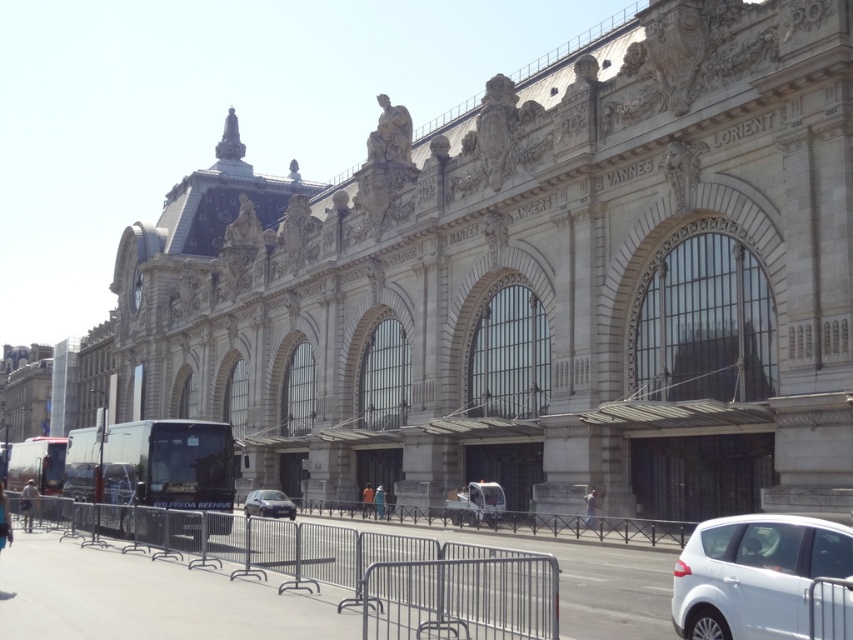
You are a pedestrian standing in front of the grand building and see both the matte black bus at lower left and the metallic silver bus at lower left. Which bus takes up more space in the image?

The metallic silver bus at lower left takes up more space in the image since the matte black bus at lower left occupies less space than it.

You are a fashion designer observing two jackets in an image of a historical train station. The scene includes a light brown leather jacket at lower left and an orange fabric jacket at center. Which jacket is covering the other one?

The light brown leather jacket at lower left is positioned over the orange fabric jacket at center, meaning it is covering the other jacket.

You are standing in front of the grand ornate building with the names Lorient, Vannes, and Nantes inscribed on it. You notice a point labeled at coordinates (36, 465). Based on the building facade details, what object is located at that point?

The point at coordinates (36, 465) indicates a metallic silver bus at lower left.